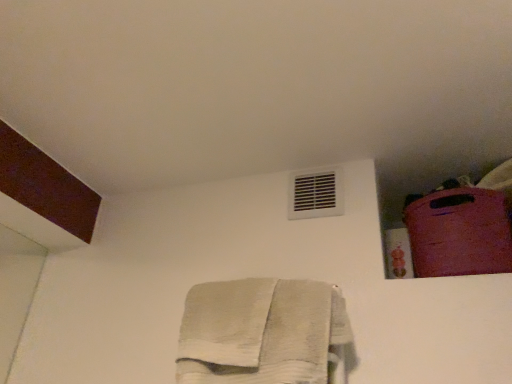
Question: Should I look upward or downward to see white cotton towel at center?

Choices:
 (A) up
 (B) down

Answer: (B)

Question: Does rubberized pink suitcase at upper right have a lesser height compared to white plastic air conditioning at upper center?

Choices:
 (A) no
 (B) yes

Answer: (A)

Question: Is rubberized pink suitcase at upper right not within white plastic air conditioning at upper center?

Choices:
 (A) no
 (B) yes

Answer: (B)

Question: Is the position of rubberized pink suitcase at upper right less distant than that of white plastic air conditioning at upper center?

Choices:
 (A) yes
 (B) no

Answer: (A)

Question: Is rubberized pink suitcase at upper right positioned far away from white plastic air conditioning at upper center?

Choices:
 (A) yes
 (B) no

Answer: (B)

Question: Is rubberized pink suitcase at upper right taller than white plastic air conditioning at upper center?

Choices:
 (A) yes
 (B) no

Answer: (A)

Question: Would you say white plastic air conditioning at upper center is part of rubberized pink suitcase at upper right's contents?

Choices:
 (A) no
 (B) yes

Answer: (A)

Question: Is white plastic air conditioning at upper center further to camera compared to white cotton towel at center?

Choices:
 (A) no
 (B) yes

Answer: (B)

Question: Is white plastic air conditioning at upper center oriented towards white cotton towel at center?

Choices:
 (A) no
 (B) yes

Answer: (A)

Question: From a real-world perspective, is white plastic air conditioning at upper center located beneath white cotton towel at center?

Choices:
 (A) yes
 (B) no

Answer: (B)

Question: Considering the relative sizes of white plastic air conditioning at upper center and white cotton towel at center in the image provided, is white plastic air conditioning at upper center shorter than white cotton towel at center?

Choices:
 (A) no
 (B) yes

Answer: (B)

Question: Is white plastic air conditioning at upper center turned away from white cotton towel at center?

Choices:
 (A) yes
 (B) no

Answer: (B)

Question: From the image's perspective, is white plastic air conditioning at upper center below white cotton towel at center?

Choices:
 (A) yes
 (B) no

Answer: (B)

Question: Is white cotton towel at center wider than white plastic air conditioning at upper center?

Choices:
 (A) yes
 (B) no

Answer: (A)